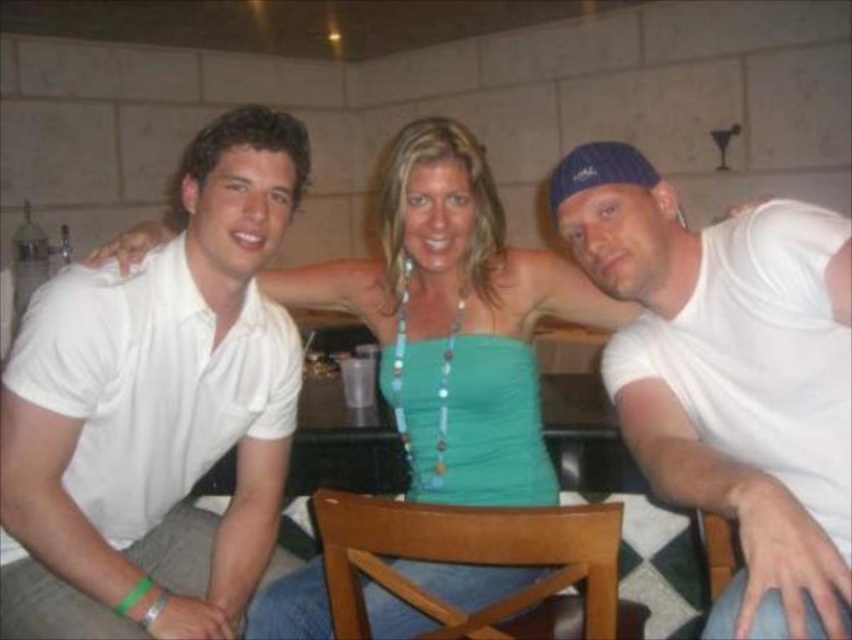
Question: Does white cotton polo shirt at left appear under teal fabric top at center?

Choices:
 (A) yes
 (B) no

Answer: (B)

Question: Among these points, which one is nearest to the camera?

Choices:
 (A) (263, 180)
 (B) (711, 576)
 (C) (320, 588)
 (D) (654, 362)

Answer: (A)

Question: Is teal fabric top at center positioned before brown wooden chair at center?

Choices:
 (A) no
 (B) yes

Answer: (A)

Question: Which object appears closest to the camera in this image?

Choices:
 (A) white cotton polo shirt at left
 (B) brown wooden chair at center
 (C) white matte tank top at right
 (D) teal fabric top at center

Answer: (C)

Question: Does brown wooden chair at center have a lesser width compared to wooden chair at center?

Choices:
 (A) no
 (B) yes

Answer: (A)

Question: Which object is positioned closest to the white cotton polo shirt at left?

Choices:
 (A) wooden chair at center
 (B) teal fabric top at center
 (C) brown wooden chair at center
 (D) white matte tank top at right

Answer: (B)